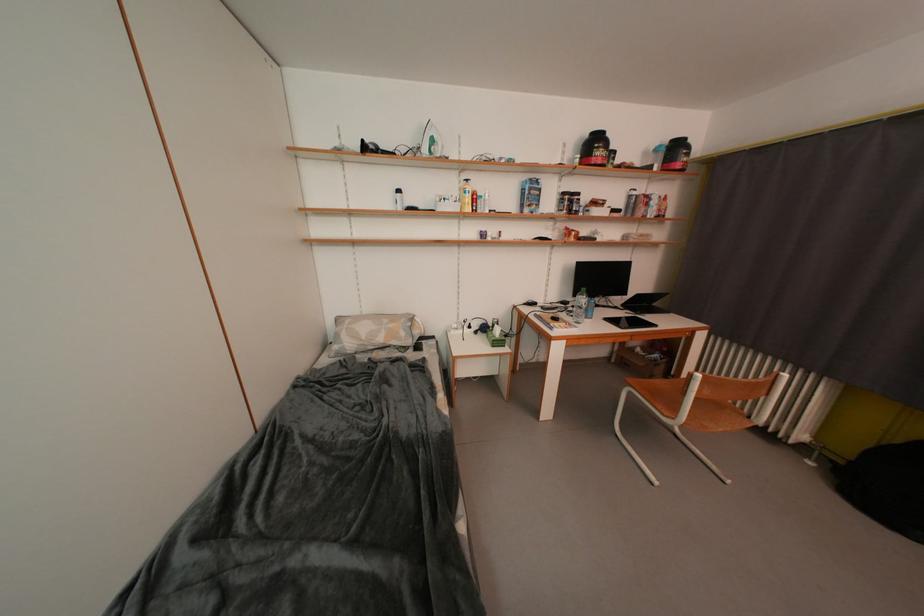
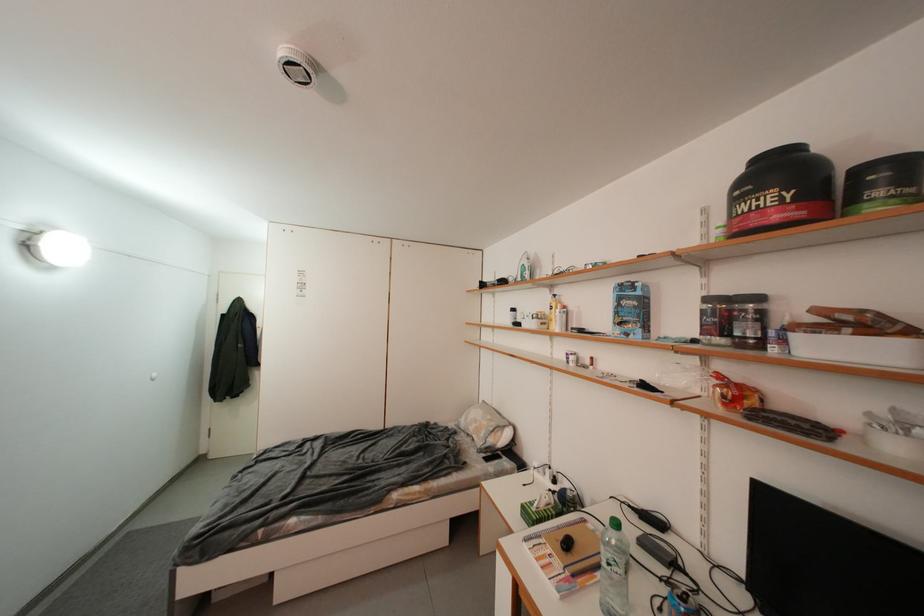
Where in the second image is the point corresponding to the point at 618,164 from the first image?

(886, 196)